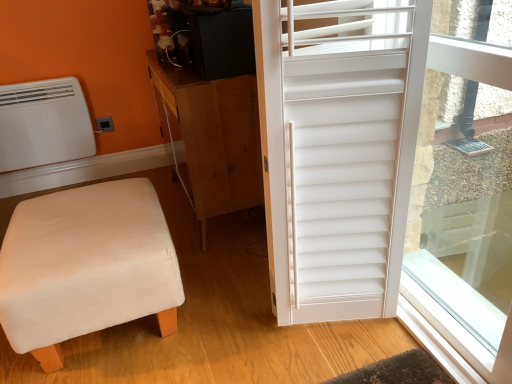
Question: Would you say white matte shutter at right is to the left or to the right of white matte window screen at right in the picture?

Choices:
 (A) left
 (B) right

Answer: (A)

Question: From a real-world perspective, relative to white matte window screen at right, is white matte shutter at right vertically above or below?

Choices:
 (A) below
 (B) above

Answer: (B)

Question: Based on their relative distances, which object is farther from the brown wood cabinet at center?

Choices:
 (A) white matte air conditioner at upper left
 (B) white matte window screen at right
 (C) white matte shutter at right
 (D) beige fabric stool at lower left

Answer: (A)

Question: Estimate the real-world distances between objects in this image. Which object is farther from the white matte window screen at right?

Choices:
 (A) brown wood cabinet at center
 (B) white matte shutter at right
 (C) beige fabric stool at lower left
 (D) white matte air conditioner at upper left

Answer: (D)